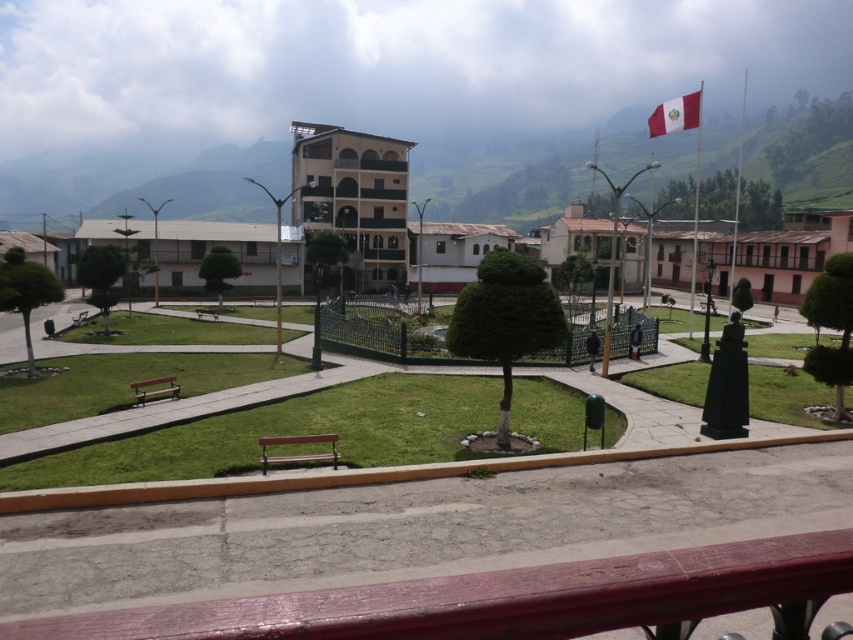
You are standing at the elevated walkway overlooking the square. There are two points marked in the image, point A at coordinates point A is point (289, 611) and point B at coordinates point B is point (689, 97). Which point is closer to your current position?

Point A at coordinates point A is point (289, 611) is closer to the viewer than point B at coordinates point B is point (689, 97).

You are a visitor in the square and want to sit on the bench that is on the left side. Which bench should you choose between the brown wooden bench at center and the wooden park bench at center?

The wooden park bench at center is on the left side because the brown wooden bench at center is to the right of it.

You are sitting on the smooth wood bench at lower center and want to move to the wooden park bench at center. Which direction should you walk to reach it?

The smooth wood bench at lower center is positioned under the wooden park bench at center, so you should walk upwards to reach the wooden park bench at center.